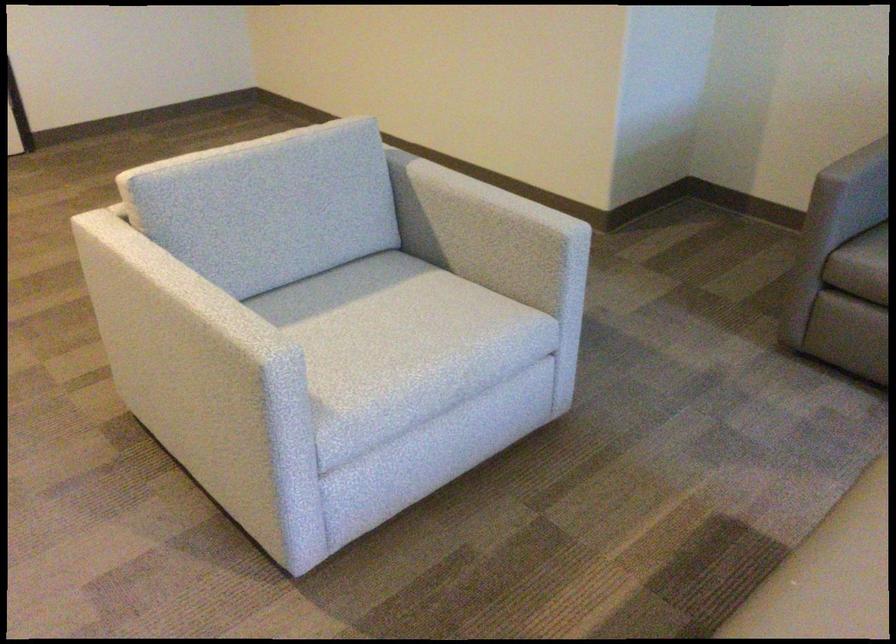
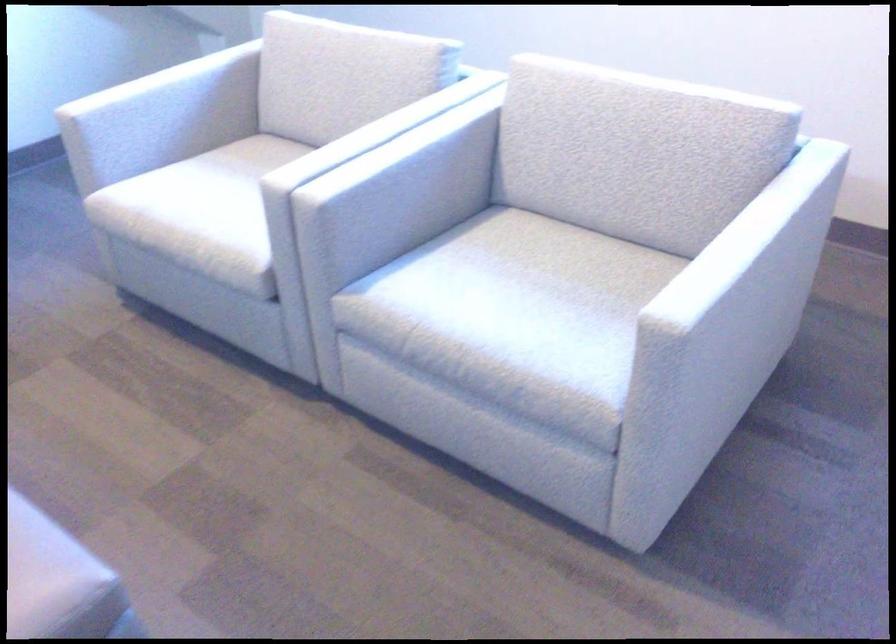
The images are taken continuously from a first-person perspective. In which direction is your viewpoint rotating?

The rotation direction of the camera is right-down.